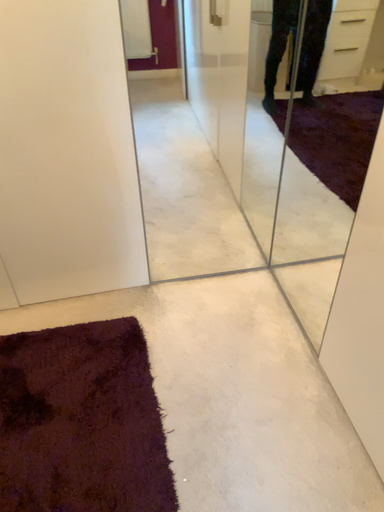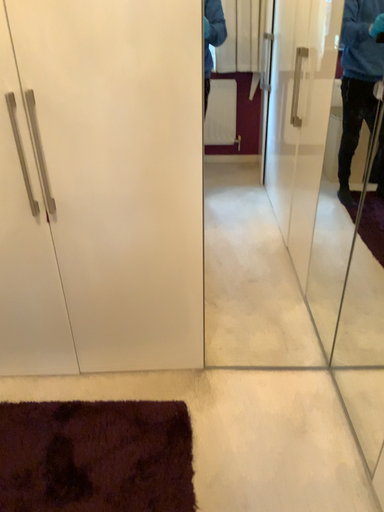
Question: How did the camera likely rotate when shooting the video?

Choices:
 (A) rotated right
 (B) rotated left

Answer: (B)